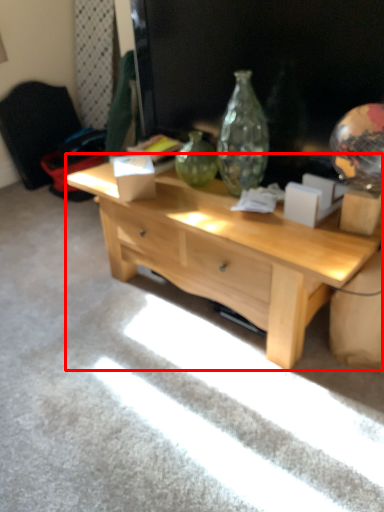
Question: Observing the image, what is the correct spatial positioning of desk (annotated by the red box) in reference to armchair?

Choices:
 (A) left
 (B) right

Answer: (B)